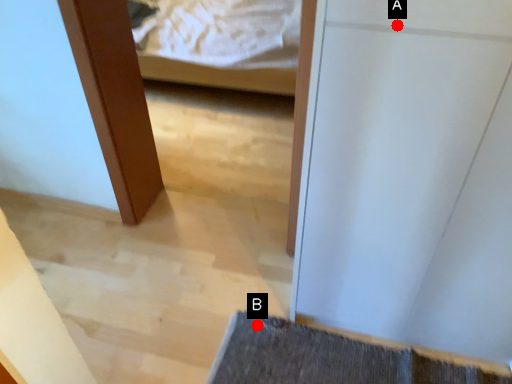
Question: Two points are circled on the image, labeled by A and B beside each circle. Which point is farther from the camera taking this photo?

Choices:
 (A) A is further
 (B) B is further

Answer: (B)